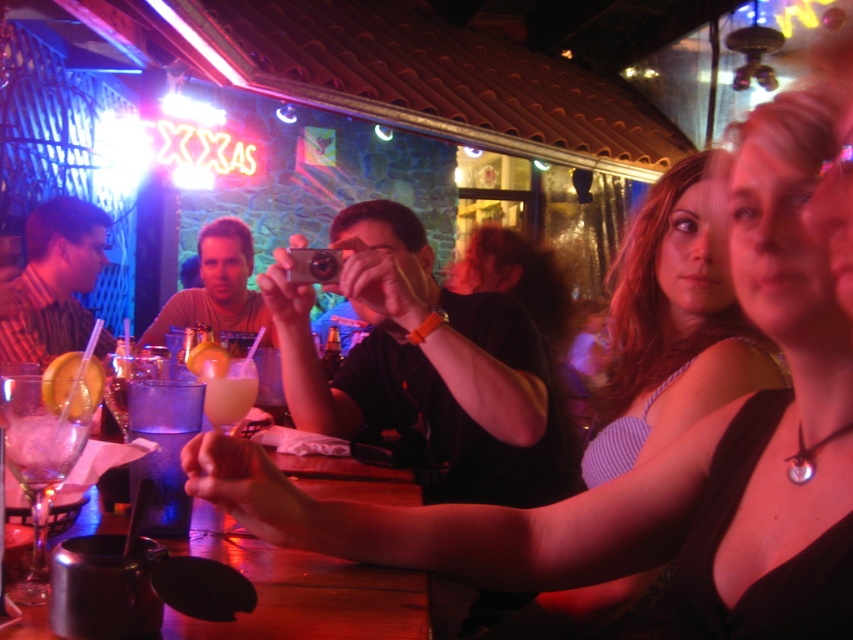
Can you confirm if matte brown shirt at left is positioned to the right of translucent glass drink at bar center?

No, matte brown shirt at left is not to the right of translucent glass drink at bar center.

Does matte brown shirt at left have a larger size compared to translucent glass drink at bar center?

Indeed, matte brown shirt at left has a larger size compared to translucent glass drink at bar center.

Is point (28, 259) positioned before point (234, 428)?

No, it is not.

Identify the location of matte brown shirt at left. (53, 282).

Consider the image. Who is more forward, (495, 545) or (247, 545)?

Point (495, 545)

Who is lower down, matte black tank top at center or metallic silver cup at lower center?

metallic silver cup at lower center

Is point (791, 433) farther from viewer compared to point (264, 630)?

Yes, it is.

The width and height of the screenshot is (853, 640). What are the coordinates of `matte black tank top at center` in the screenshot? It's located at coord(670,444).

Between matte black camera at center and matte brown shirt at center, which one is positioned lower?

matte black camera at center is below.

Does point (321, 384) come in front of point (264, 308)?

Yes, point (321, 384) is in front of point (264, 308).

Identify the location of matte black camera at center. This screenshot has width=853, height=640. (428, 368).